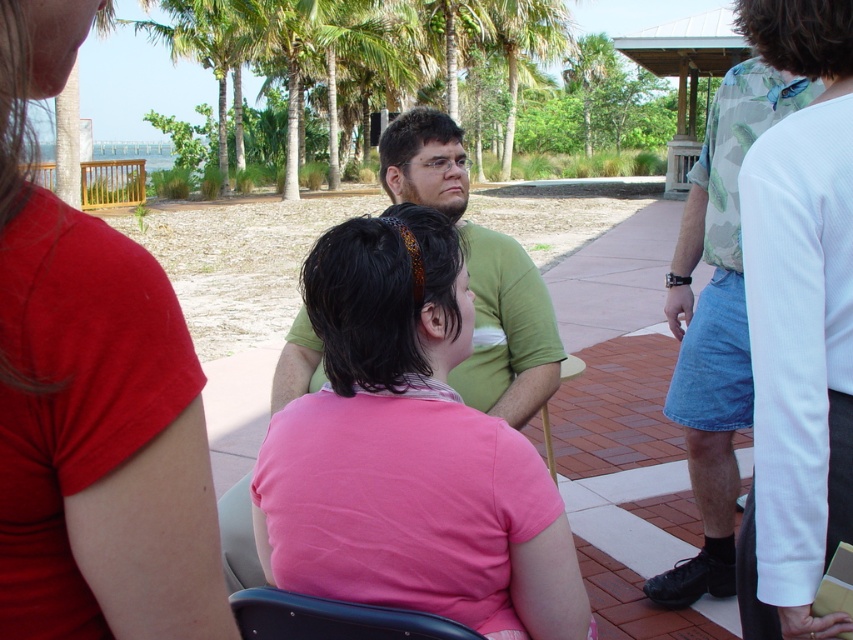
Is the position of green matte shirt at center less distant than that of black plastic chair at lower center?

No, it is not.

Between green matte shirt at center and black plastic chair at lower center, which one appears on the right side from the viewer's perspective?

green matte shirt at center is more to the right.

Is point (558, 358) behind point (271, 637)?

That is True.

What are the coordinates of `green matte shirt at center` in the screenshot? It's located at (479, 273).

Who is more forward, (809, 412) or (4, 518)?

Positioned in front is point (4, 518).

Measure the distance between white textured shirt at upper right and camera.

white textured shirt at upper right is 5.04 feet from camera.

What do you see at coordinates (798, 323) in the screenshot? This screenshot has height=640, width=853. I see `white textured shirt at upper right` at bounding box center [798, 323].

Locate an element on the screen. This screenshot has width=853, height=640. white textured shirt at upper right is located at coordinates click(x=798, y=323).

Which is below, matte pink shirt at center or green matte shirt at center?

matte pink shirt at center

In order to click on matte pink shirt at center in this screenshot , I will do `click(134, 481)`.